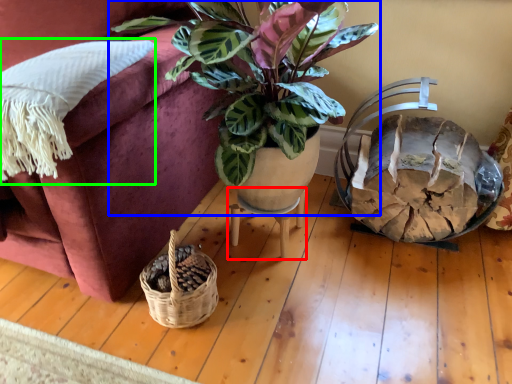
Question: Which is nearer to the table (highlighted by a red box)? houseplant (highlighted by a blue box) or pillow (highlighted by a green box).

Choices:
 (A) houseplant
 (B) pillow

Answer: (A)